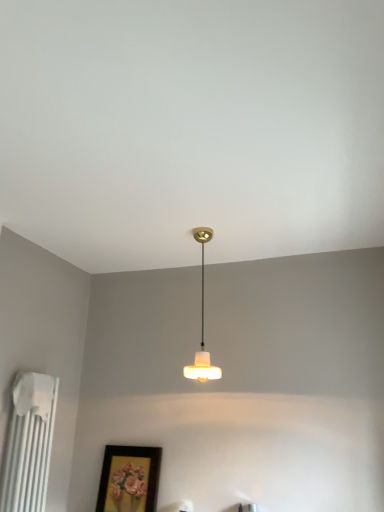
Question: Is white matte radiator at left located within matte gold picture frame at lower center?

Choices:
 (A) yes
 (B) no

Answer: (B)

Question: Does matte gold picture frame at lower center appear on the right side of white matte radiator at left?

Choices:
 (A) no
 (B) yes

Answer: (B)

Question: From the image's perspective, would you say matte gold picture frame at lower center is shown under white matte radiator at left?

Choices:
 (A) yes
 (B) no

Answer: (A)

Question: Would you consider matte gold picture frame at lower center to be distant from white matte radiator at left?

Choices:
 (A) no
 (B) yes

Answer: (A)

Question: Is matte gold picture frame at lower center smaller than white matte radiator at left?

Choices:
 (A) no
 (B) yes

Answer: (B)

Question: Visually, is white frosted glass lampshade at center positioned to the left or to the right of matte gold picture frame at lower center?

Choices:
 (A) right
 (B) left

Answer: (A)

Question: In the image, is white frosted glass lampshade at center positioned in front of or behind matte gold picture frame at lower center?

Choices:
 (A) behind
 (B) front

Answer: (B)

Question: Is white frosted glass lampshade at center situated inside matte gold picture frame at lower center or outside?

Choices:
 (A) inside
 (B) outside

Answer: (B)

Question: Looking at their shapes, would you say white frosted glass lampshade at center is wider or thinner than matte gold picture frame at lower center?

Choices:
 (A) wide
 (B) thin

Answer: (A)

Question: Considering the positions of matte gold picture frame at lower center and white frosted glass lampshade at center in the image, is matte gold picture frame at lower center taller or shorter than white frosted glass lampshade at center?

Choices:
 (A) tall
 (B) short

Answer: (B)

Question: Based on their sizes in the image, would you say matte gold picture frame at lower center is bigger or smaller than white frosted glass lampshade at center?

Choices:
 (A) small
 (B) big

Answer: (A)

Question: Considering the positions of matte gold picture frame at lower center and white frosted glass lampshade at center in the image, is matte gold picture frame at lower center wider or thinner than white frosted glass lampshade at center?

Choices:
 (A) thin
 (B) wide

Answer: (A)

Question: Considering the relative positions of matte gold picture frame at lower center and white frosted glass lampshade at center in the image provided, is matte gold picture frame at lower center to the left or to the right of white frosted glass lampshade at center?

Choices:
 (A) right
 (B) left

Answer: (B)

Question: From their relative heights in the image, would you say white matte radiator at left is taller or shorter than white frosted glass lampshade at center?

Choices:
 (A) short
 (B) tall

Answer: (A)

Question: From a real-world perspective, is white matte radiator at left above or below white frosted glass lampshade at center?

Choices:
 (A) above
 (B) below

Answer: (B)